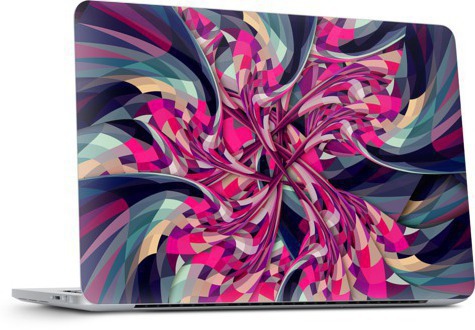
You are a GUI agent. You are given a task and a screenshot of the screen. Output one action in this format:
    pyautogui.click(x=<x>, y=<y>)
    Task: Click on the space below laptop
    
    Given the screenshot: What is the action you would take?
    pyautogui.click(x=239, y=318)